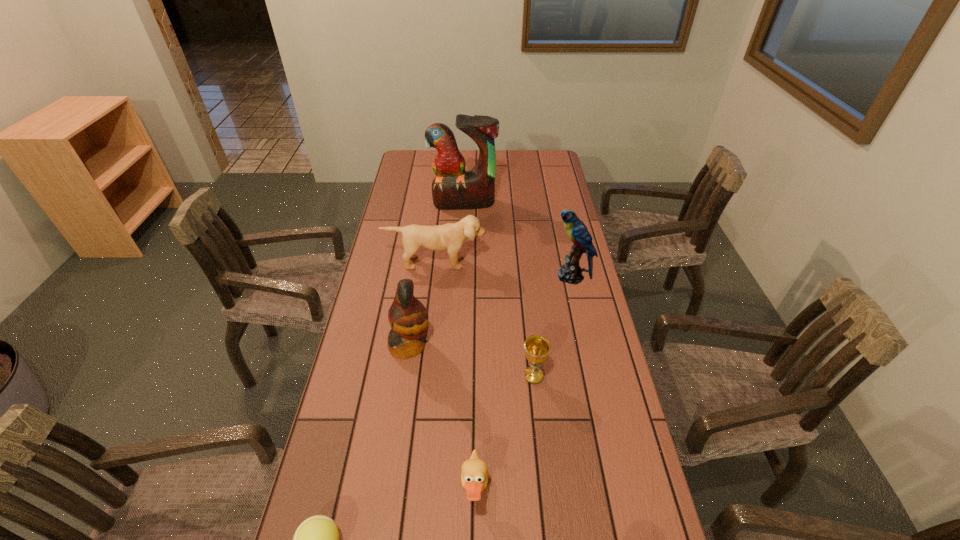
Find the location of a particular element. This screenshot has height=540, width=960. blank space at the far edge of the desktop is located at coordinates (504, 165).

Locate an element on the screen. vacant space at the left edge of the desktop is located at coordinates 380,469.

This screenshot has width=960, height=540. In order to click on blank space at the right edge in this screenshot , I will do `click(621, 504)`.

The height and width of the screenshot is (540, 960). Find the location of `vacant region at the far right corner of the desktop`. vacant region at the far right corner of the desktop is located at coordinates (549, 171).

Image resolution: width=960 pixels, height=540 pixels. In order to click on vacant point located between the fourth tallest object and the second farthest parrot in this screenshot , I will do `click(503, 269)`.

This screenshot has height=540, width=960. In order to click on vacant point located between the fourth tallest object and the rightmost object in this screenshot , I will do coord(503,269).

Identify the location of free space between the second object from right to left and the puppy. (485, 319).

Locate an element on the screen. free space between the puppy and the second nearest object is located at coordinates (455, 376).

The width and height of the screenshot is (960, 540). I want to click on unoccupied position between the second object from right to left and the farthest parrot, so click(498, 289).

Locate an element on the screen. The image size is (960, 540). unoccupied area between the sixth farthest object and the fourth shortest object is located at coordinates (455, 376).